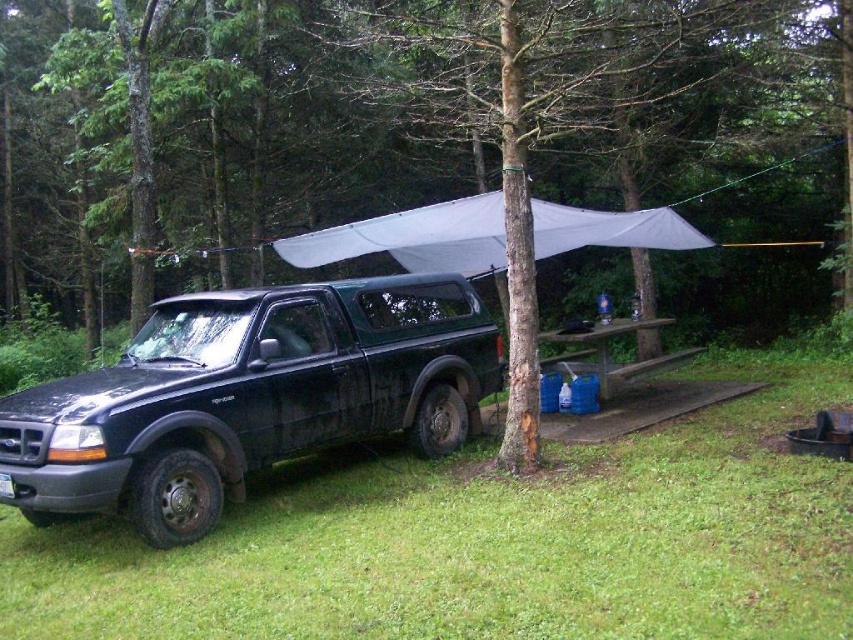
Question: Does green grass at lower left have a larger size compared to white fabric canopy at center?

Choices:
 (A) no
 (B) yes

Answer: (A)

Question: Which object is positioned closest to the blue plastic picnic table at center?

Choices:
 (A) green bark tree at center
 (B) matte black truck at left
 (C) white fabric canopy at center
 (D) green grass at lower left

Answer: (C)

Question: Does green bark tree at center have a greater width compared to matte black truck at left?

Choices:
 (A) yes
 (B) no

Answer: (A)

Question: Does green bark tree at center lie in front of green grass at lower left?

Choices:
 (A) no
 (B) yes

Answer: (A)

Question: Estimate the real-world distances between objects in this image. Which object is closer to the blue plastic picnic table at center?

Choices:
 (A) green grass at lower left
 (B) green bark tree at center

Answer: (A)

Question: Which object appears closest to the camera in this image?

Choices:
 (A) blue plastic picnic table at center
 (B) green bark tree at center
 (C) matte black truck at left

Answer: (C)